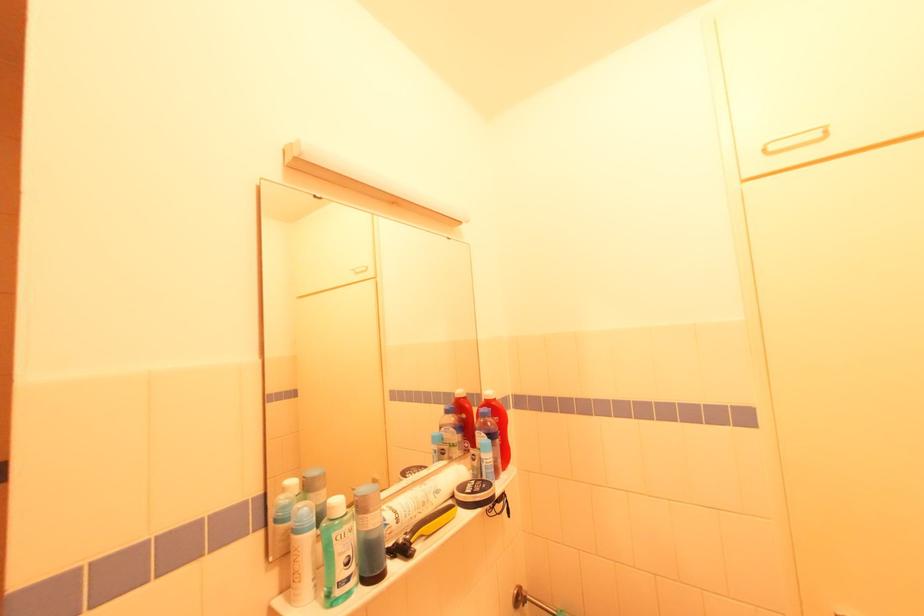
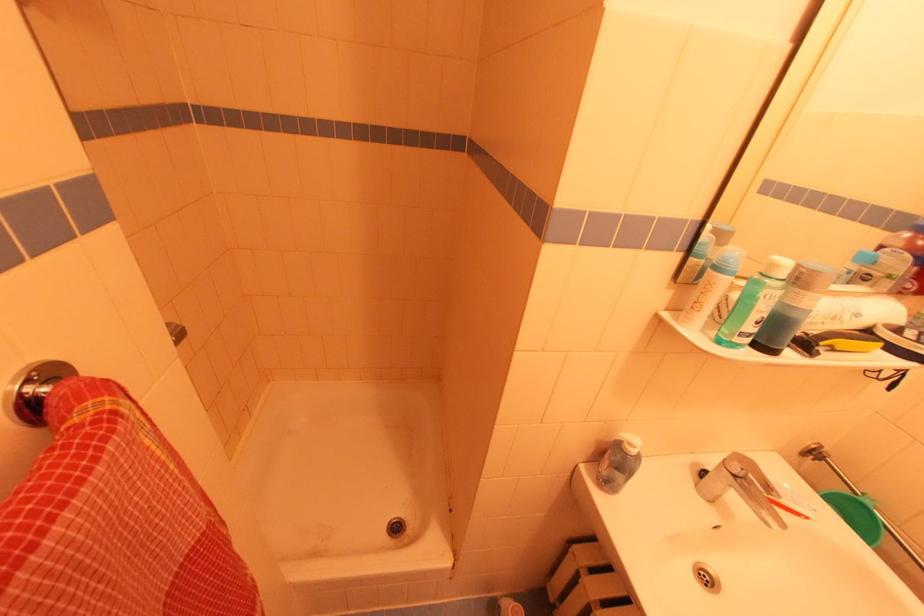
Based on the continuous images, in which direction is the camera rotating?

The camera rotated toward left-down.